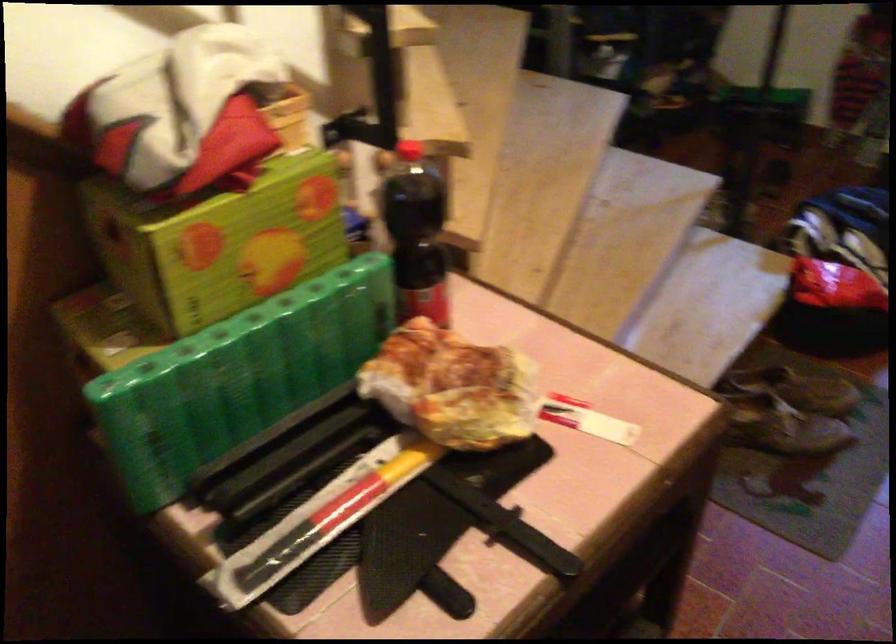
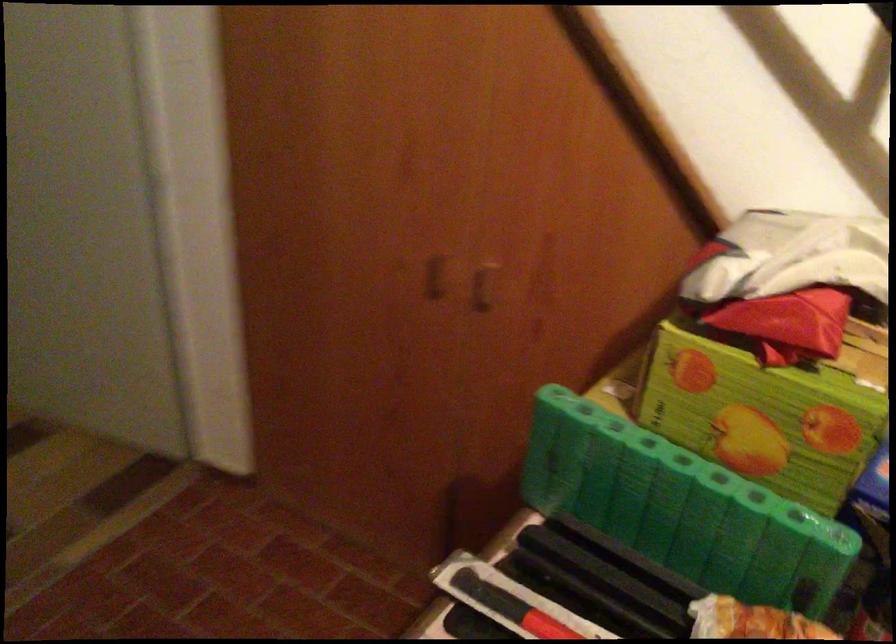
Find the pixel in the second image that matches (x=195, y=263) in the first image.

(686, 377)